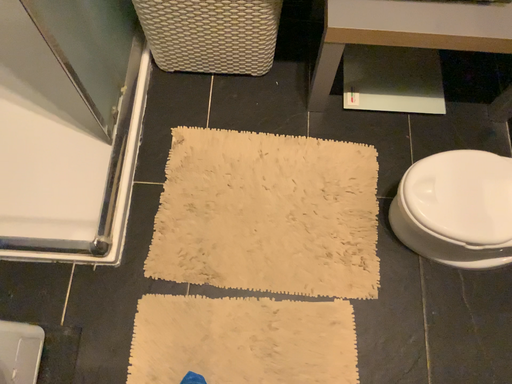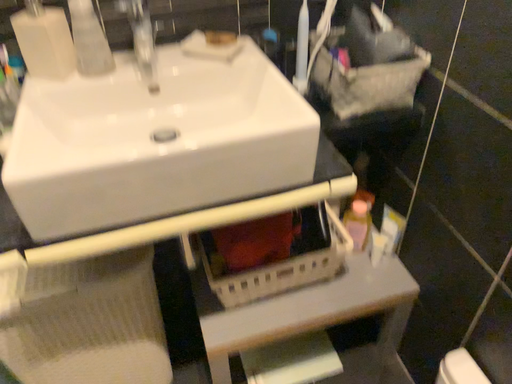
Question: How did the camera likely rotate when shooting the video?

Choices:
 (A) rotated upward
 (B) rotated downward

Answer: (A)